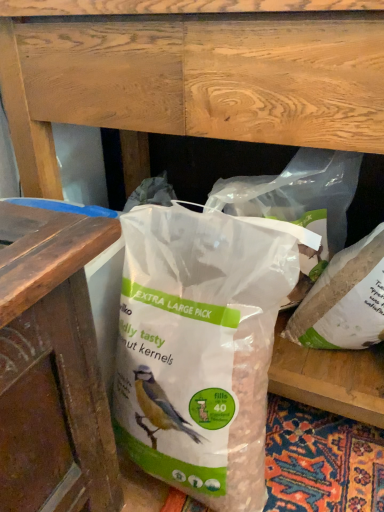
Question: Should I look upward or downward to see white matte plastic bag at center, the third plastic bag in the left-to-right sequence?

Choices:
 (A) down
 (B) up

Answer: (A)

Question: Is translucent plastic bag at center, the 2th plastic bag positioned from the right, bigger than white matte plastic bag at center, arranged as the 1th plastic bag when viewed from the right?

Choices:
 (A) no
 (B) yes

Answer: (B)

Question: Can you confirm if translucent plastic bag at center, the 2th plastic bag positioned from the right, is positioned to the right of white matte plastic bag at center, the third plastic bag in the left-to-right sequence?

Choices:
 (A) yes
 (B) no

Answer: (B)

Question: Could you tell me if translucent plastic bag at center, the 2th plastic bag positioned from the right, is turned towards white matte plastic bag at center, arranged as the 1th plastic bag when viewed from the right?

Choices:
 (A) yes
 (B) no

Answer: (B)

Question: From the image's perspective, is translucent plastic bag at center, the 2th plastic bag positioned from the right, located beneath white matte plastic bag at center, arranged as the 1th plastic bag when viewed from the right?

Choices:
 (A) yes
 (B) no

Answer: (B)

Question: From a real-world perspective, does translucent plastic bag at center, the 2th plastic bag positioned from the right, stand above white matte plastic bag at center, the third plastic bag in the left-to-right sequence?

Choices:
 (A) no
 (B) yes

Answer: (B)

Question: Is translucent plastic bag at center, marked as the second plastic bag in a left-to-right arrangement, smaller than white matte plastic bag at center, arranged as the 1th plastic bag when viewed from the right?

Choices:
 (A) yes
 (B) no

Answer: (B)

Question: Considering the relative sizes of translucent plastic bag at center, the 2th plastic bag positioned from the right, and translucent plastic bag at center, placed as the 3th plastic bag when sorted from right to left, in the image provided, is translucent plastic bag at center, the 2th plastic bag positioned from the right, wider than translucent plastic bag at center, placed as the 3th plastic bag when sorted from right to left,?

Choices:
 (A) yes
 (B) no

Answer: (B)

Question: Are translucent plastic bag at center, marked as the second plastic bag in a left-to-right arrangement, and translucent plastic bag at center, the first plastic bag positioned from the left, located far from each other?

Choices:
 (A) yes
 (B) no

Answer: (B)

Question: Can you confirm if translucent plastic bag at center, the 2th plastic bag positioned from the right, is taller than translucent plastic bag at center, placed as the 3th plastic bag when sorted from right to left?

Choices:
 (A) yes
 (B) no

Answer: (B)

Question: Is translucent plastic bag at center, the 2th plastic bag positioned from the right, smaller than translucent plastic bag at center, the first plastic bag positioned from the left?

Choices:
 (A) yes
 (B) no

Answer: (A)

Question: Is the position of translucent plastic bag at center, the 2th plastic bag positioned from the right, more distant than that of translucent plastic bag at center, the first plastic bag positioned from the left?

Choices:
 (A) no
 (B) yes

Answer: (B)

Question: From a real-world perspective, does translucent plastic bag at center, the 2th plastic bag positioned from the right, sit lower than translucent plastic bag at center, the first plastic bag positioned from the left?

Choices:
 (A) no
 (B) yes

Answer: (A)

Question: From a real-world perspective, is white matte plastic bag at center, arranged as the 1th plastic bag when viewed from the right, under translucent plastic bag at center, marked as the second plastic bag in a left-to-right arrangement?

Choices:
 (A) yes
 (B) no

Answer: (A)